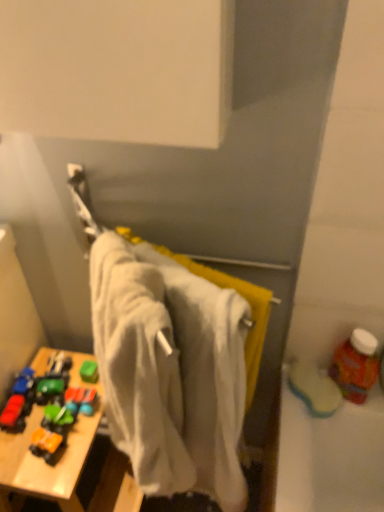
Question: Is point (340, 356) closer or farther from the camera than point (36, 353)?

Choices:
 (A) closer
 (B) farther

Answer: (A)

Question: Is translucent plastic bottle at right bigger or smaller than wooden toy at lower left?

Choices:
 (A) small
 (B) big

Answer: (A)

Question: Which object is the farthest from the wooden toy at lower left?

Choices:
 (A) translucent plastic bottle at right
 (B) white cotton towel at center
 (C) rubberized plastic toy car at lower left

Answer: (A)

Question: Which of these objects is positioned farthest from the translucent plastic bottle at right?

Choices:
 (A) wooden toy at lower left
 (B) white cotton towel at center
 (C) rubberized plastic toy car at lower left

Answer: (C)